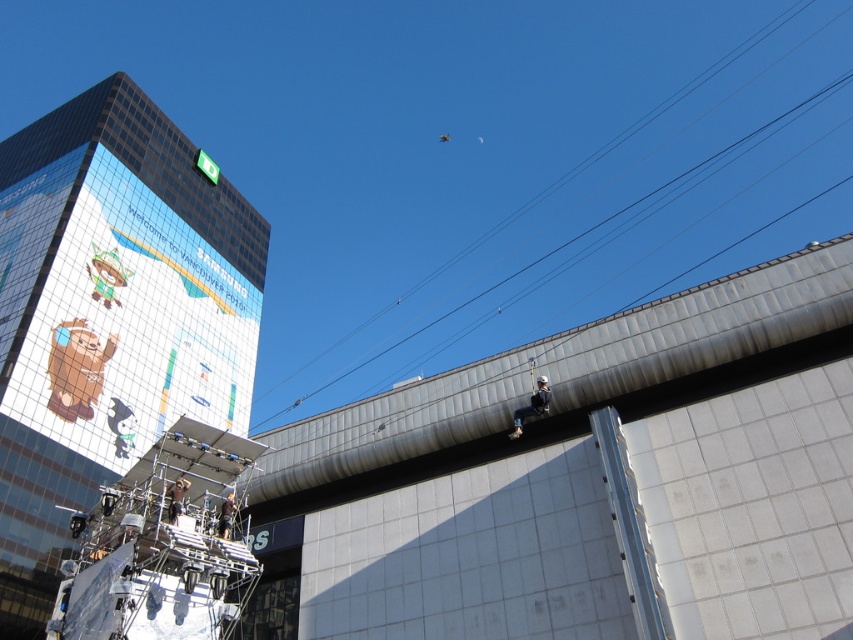
Question: Is metallic helmet at lower left to the left of dark brown leather jacket at lower center from the viewer's perspective?

Choices:
 (A) no
 (B) yes

Answer: (B)

Question: Considering the real-world distances, which object is closest to the reflective glass billboard at upper left?

Choices:
 (A) dark brown leather jacket at lower center
 (B) black wire at upper center
 (C) dark gray fabric helmet at upper right
 (D) metallic helmet at lower left

Answer: (A)

Question: Among these points, which one is farthest from the camera?

Choices:
 (A) (184, 484)
 (B) (225, 525)
 (C) (273, 392)
 (D) (546, 385)

Answer: (C)

Question: Is reflective glass billboard at upper left in front of dark gray fabric helmet at upper right?

Choices:
 (A) no
 (B) yes

Answer: (A)

Question: Among these objects, which one is nearest to the camera?

Choices:
 (A) black wire at upper center
 (B) metallic helmet at lower left
 (C) dark gray fabric helmet at upper right

Answer: (B)

Question: Where is black wire at upper center located in relation to dark brown leather jacket at lower center in the image?

Choices:
 (A) below
 (B) above

Answer: (B)